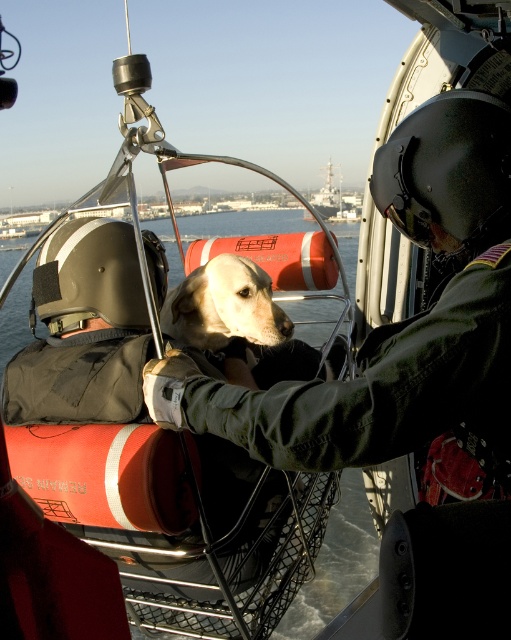
You are a passenger in the helicopter and need to determine if the golden fur dog at center can fit under the metallic gray ship at center. Based on their sizes, can it fit?

The golden fur dog at center is shorter than metallic gray ship at center, so it can fit under the metallic gray ship at center.